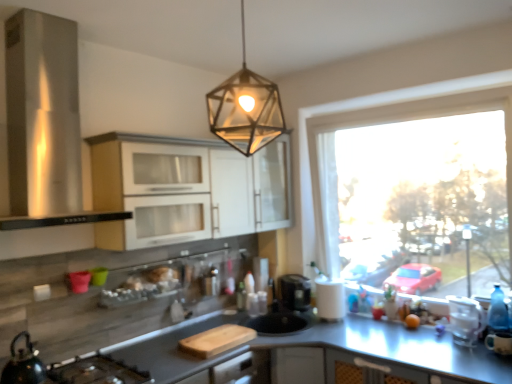
Question: From a real-world perspective, is metallic hexagonal light fixture at upper center positioned above or below matte white cabinet at upper center, which is the 1th cabinetry from back to front?

Choices:
 (A) above
 (B) below

Answer: (A)

Question: Is metallic hexagonal light fixture at upper center wider or thinner than matte white cabinet at upper center, which is the 1th cabinetry from back to front?

Choices:
 (A) wide
 (B) thin

Answer: (A)

Question: Which of these objects is positioned farthest from the black matte gas stove at lower left?

Choices:
 (A) clear plastic container at right
 (B) stainless steel range hood at left
 (C) white matte paper towel at right
 (D) white glossy cabinets at upper center, the second cabinetry positioned from the back
 (E) metallic hexagonal light fixture at upper center

Answer: (A)

Question: Which object is positioned farthest from the shiny black kettle at lower left?

Choices:
 (A) metallic hexagonal light fixture at upper center
 (B) matte white cabinet at upper center, which is the 1th cabinetry from back to front
 (C) translucent glass bottle at center
 (D) clear plastic container at right
 (E) transparent glass window at right

Answer: (D)